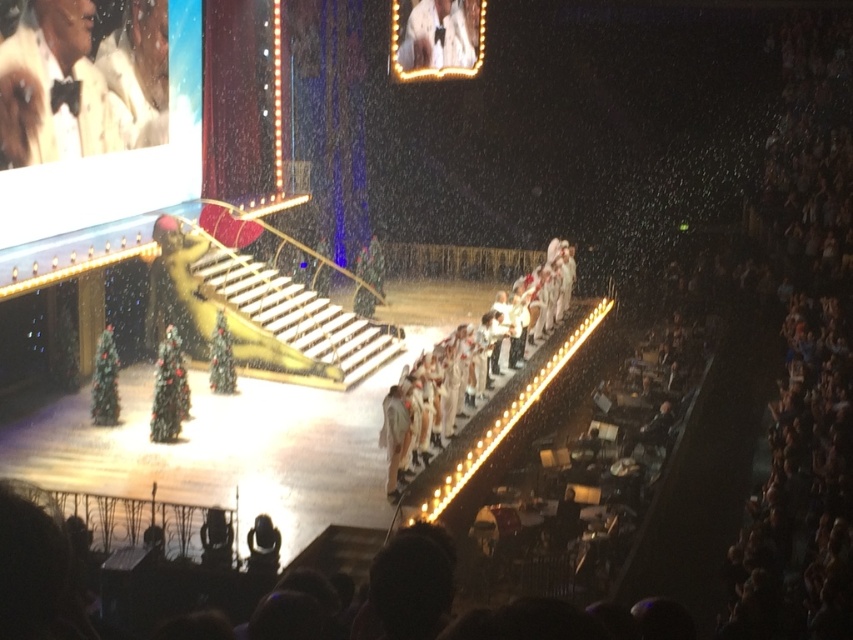
Can you confirm if white fabric dress at center is smaller than white satin dress at upper center?

Actually, white fabric dress at center might be larger than white satin dress at upper center.

Is point (438, 244) positioned after point (425, 26)?

Yes, it is.

The height and width of the screenshot is (640, 853). What do you see at coordinates (502, 300) in the screenshot?
I see `white fabric dress at center` at bounding box center [502, 300].

In order to click on white fabric dress at center in this screenshot , I will do `click(502, 300)`.